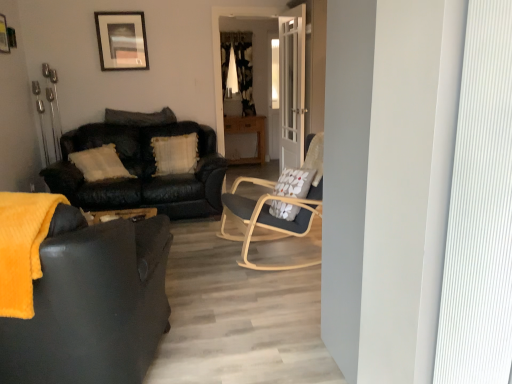
Question: Which direction should I rotate to look at leather couch at center, placed as the 2th studio couch when sorted from front to back?

Choices:
 (A) left
 (B) right

Answer: (A)

Question: Should I look upward or downward to see white glass door at center?

Choices:
 (A) down
 (B) up

Answer: (B)

Question: Does black/white textured curtain at center lie behind light wood/woodenchair at center?

Choices:
 (A) no
 (B) yes

Answer: (B)

Question: Considering the relative sizes of black/white textured curtain at center and light wood/woodenchair at center in the image provided, is black/white textured curtain at center thinner than light wood/woodenchair at center?

Choices:
 (A) no
 (B) yes

Answer: (B)

Question: Is black/white textured curtain at center shorter than light wood/woodenchair at center?

Choices:
 (A) no
 (B) yes

Answer: (A)

Question: Are black/white textured curtain at center and light wood/woodenchair at center located far from each other?

Choices:
 (A) no
 (B) yes

Answer: (B)

Question: From the image's perspective, is black/white textured curtain at center over light wood/woodenchair at center?

Choices:
 (A) yes
 (B) no

Answer: (A)

Question: Does black/white textured curtain at center have a greater height compared to light wood/woodenchair at center?

Choices:
 (A) yes
 (B) no

Answer: (A)

Question: Does wooden cabinet at center come in front of brushed metal picture frame at upper left, which is counted as the 2th picture frame, starting from the back?

Choices:
 (A) no
 (B) yes

Answer: (A)

Question: Is wooden cabinet at center with brushed metal picture frame at upper left, arranged as the 1th picture frame when viewed from the left?

Choices:
 (A) yes
 (B) no

Answer: (B)

Question: Does wooden cabinet at center contain brushed metal picture frame at upper left, the second picture frame when ordered from right to left?

Choices:
 (A) yes
 (B) no

Answer: (B)

Question: Considering the relative positions of wooden cabinet at center and brushed metal picture frame at upper left, the second picture frame when ordered from right to left, in the image provided, is wooden cabinet at center to the right of brushed metal picture frame at upper left, the second picture frame when ordered from right to left, from the viewer's perspective?

Choices:
 (A) no
 (B) yes

Answer: (B)

Question: Could you tell me if wooden cabinet at center is facing brushed metal picture frame at upper left, placed as the first picture frame when sorted from front to back?

Choices:
 (A) no
 (B) yes

Answer: (A)

Question: From the image's perspective, is wooden cabinet at center beneath brushed metal picture frame at upper left, which is counted as the 2th picture frame, starting from the back?

Choices:
 (A) yes
 (B) no

Answer: (A)

Question: Is light wood/woodenchair at center further to the viewer compared to leather couch at center, placed as the 2th studio couch when sorted from front to back?

Choices:
 (A) no
 (B) yes

Answer: (A)